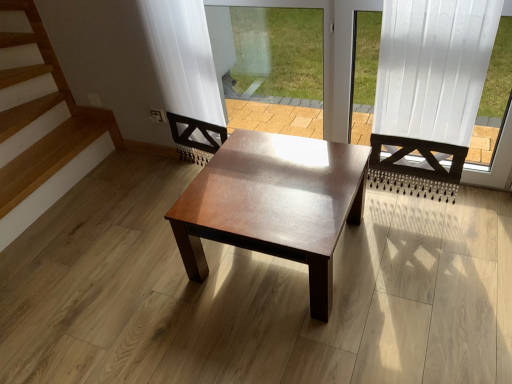
Question: Considering the relative sizes of transparent glass window screen at center and white wood frame at upper right in the image provided, is transparent glass window screen at center taller than white wood frame at upper right?

Choices:
 (A) yes
 (B) no

Answer: (B)

Question: From a real-world perspective, is transparent glass window screen at center physically below white wood frame at upper right?

Choices:
 (A) yes
 (B) no

Answer: (A)

Question: Can you confirm if transparent glass window screen at center is wider than white wood frame at upper right?

Choices:
 (A) no
 (B) yes

Answer: (A)

Question: From the image's perspective, does transparent glass window screen at center appear lower than white wood frame at upper right?

Choices:
 (A) no
 (B) yes

Answer: (A)

Question: Is transparent glass window screen at center aimed at white wood frame at upper right?

Choices:
 (A) yes
 (B) no

Answer: (B)

Question: Is white wood frame at upper right taller or shorter than transparent glass window screen at center?

Choices:
 (A) short
 (B) tall

Answer: (B)

Question: From the image's perspective, is white wood frame at upper right located above or below transparent glass window screen at center?

Choices:
 (A) above
 (B) below

Answer: (B)

Question: Looking at the image, does white wood frame at upper right seem bigger or smaller compared to transparent glass window screen at center?

Choices:
 (A) big
 (B) small

Answer: (A)

Question: From a real-world perspective, is white wood frame at upper right positioned above or below transparent glass window screen at center?

Choices:
 (A) above
 (B) below

Answer: (A)

Question: In the image, is shiny brown wood coffee table at center positioned in front of or behind white wood frame at upper right?

Choices:
 (A) front
 (B) behind

Answer: (B)

Question: Is shiny brown wood coffee table at center to the left or to the right of white wood frame at upper right in the image?

Choices:
 (A) left
 (B) right

Answer: (A)

Question: Looking at their shapes, would you say shiny brown wood coffee table at center is wider or thinner than white wood frame at upper right?

Choices:
 (A) wide
 (B) thin

Answer: (A)

Question: From the image's perspective, relative to white wood frame at upper right, is shiny brown wood coffee table at center above or below?

Choices:
 (A) below
 (B) above

Answer: (A)

Question: Looking at the image, does white wood frame at upper right seem bigger or smaller compared to shiny brown wood coffee table at center?

Choices:
 (A) big
 (B) small

Answer: (B)

Question: Is white wood frame at upper right wider or thinner than shiny brown wood coffee table at center?

Choices:
 (A) wide
 (B) thin

Answer: (B)